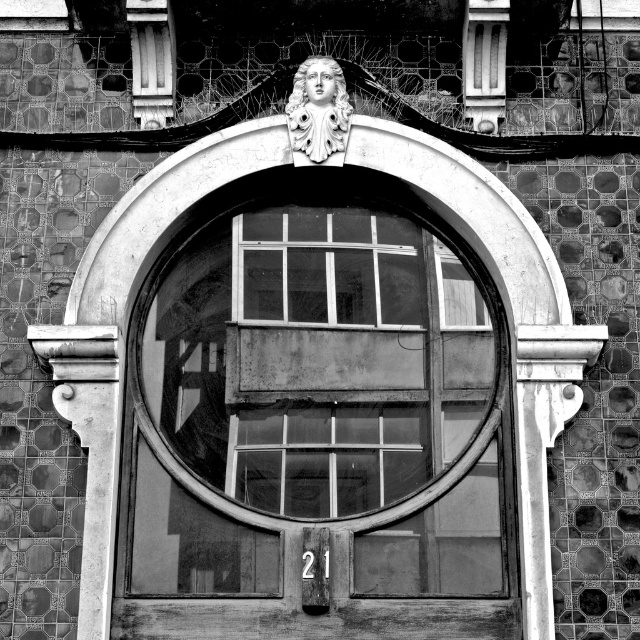
You are an art conservator examining this architectural detail. You need to clean the transparent glass window at center and the matte stone face at upper center. Which object should you clean first if you want to start with the one that is closer to you?

The transparent glass window at center is in front of the matte stone face at upper center, so you should clean the transparent glass window at center first since it is closer to you.

You are an architect examining this historical structure. You need to determine the spatial relationship between the transparent glass window at center and the matte stone face at upper center. Which object occupies a greater vertical height in this composition?

The transparent glass window at center is taller than the matte stone face at upper center, so it occupies a greater vertical height in the composition.

You are an architect designing a new building and want to replicate the distance between the transparent glass window at center and the matte stone face at upper center seen in this image. What is the exact distance you should maintain between these two elements?

The transparent glass window at center and the matte stone face at upper center are 10.69 meters apart from each other, so you should maintain a distance of 10.69 meters between them.